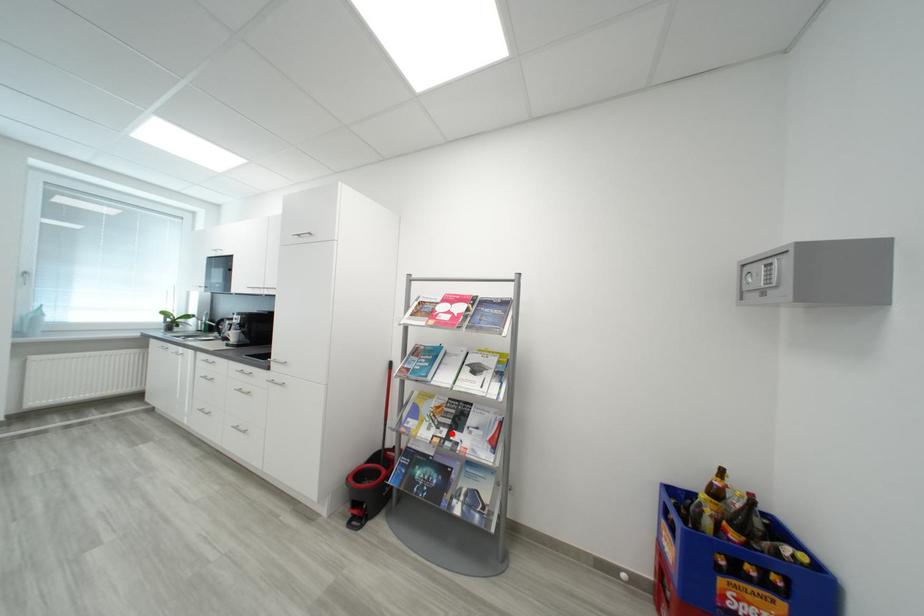
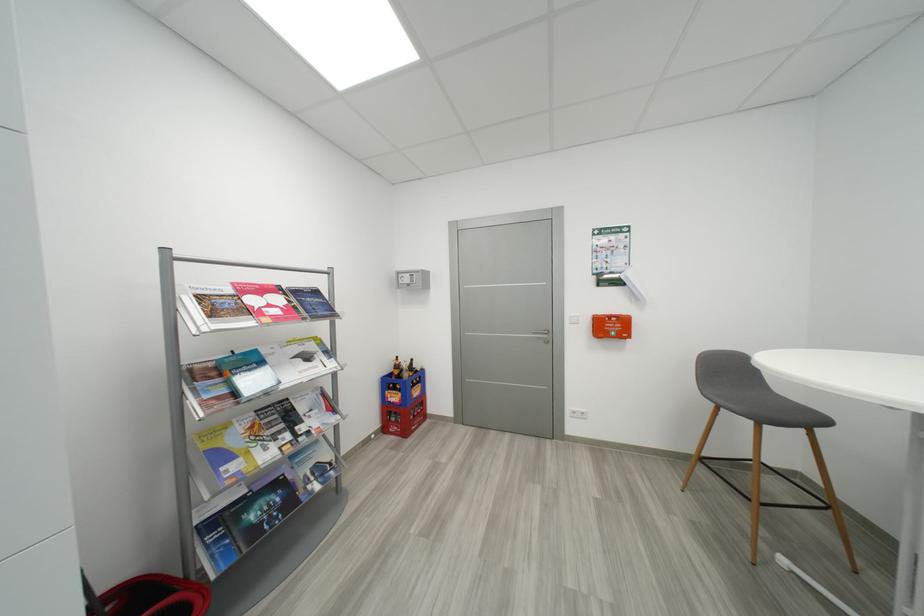
Question: A red point is marked in image1. In image2, is the corresponding 3D point closer to the camera or farther? Reply with the corresponding letter.

Choices:
 (A) The corresponding 3D point is closer.
 (B) The corresponding 3D point is farther.

Answer: (A)